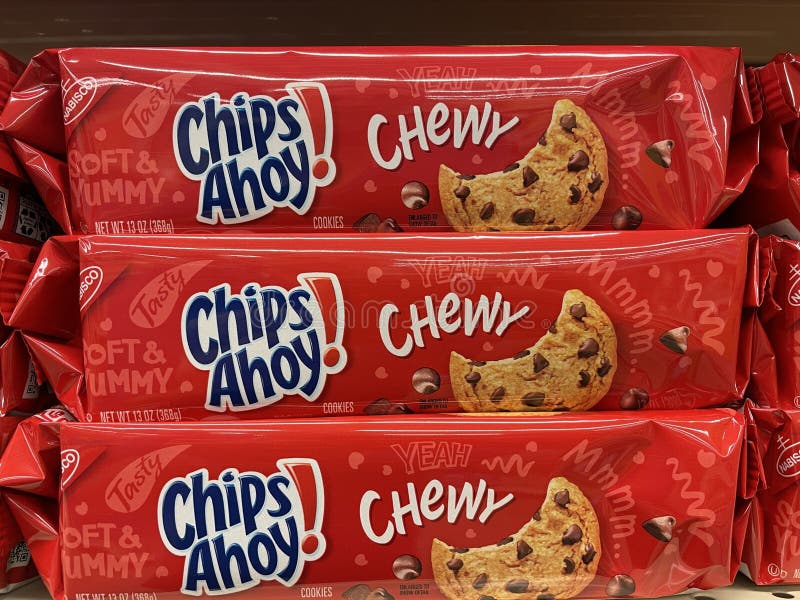
The image size is (800, 600). What are the coordinates of `shelf bottom` in the screenshot? It's located at (550, 19).